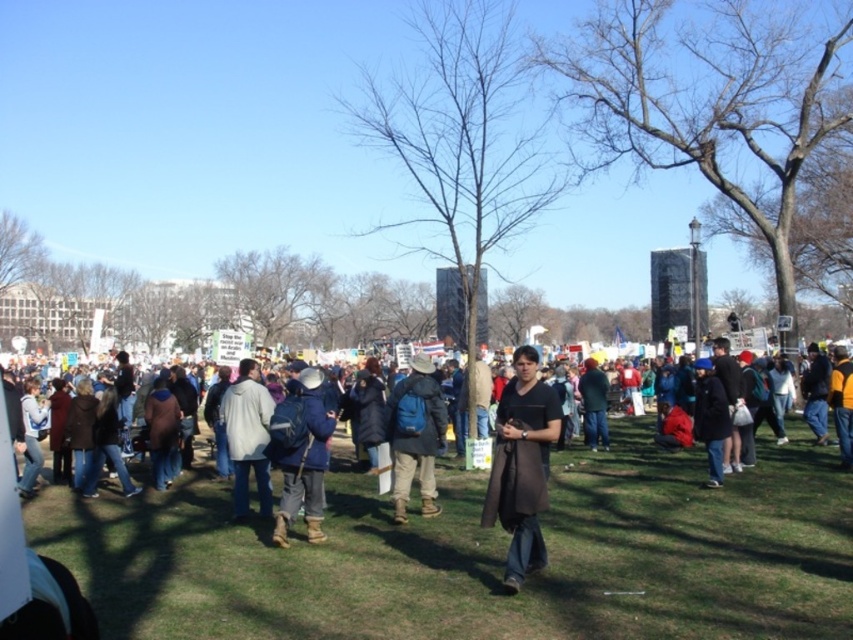
Identify the location of blue fabric jacket at center. (302, 458).

Where is `blue fabric jacket at center`? The image size is (853, 640). blue fabric jacket at center is located at coordinates (302, 458).

Which is more to the right, green grass at center or blue fabric jacket at center?

Positioned to the right is green grass at center.

What do you see at coordinates (480, 556) in the screenshot? Image resolution: width=853 pixels, height=640 pixels. I see `green grass at center` at bounding box center [480, 556].

Does point (810, 454) come closer to viewer compared to point (306, 502)?

No.

I want to click on green grass at center, so tap(480, 556).

Is blue backpack at center to the right of dark blue fabric jacket at center from the viewer's perspective?

No, blue backpack at center is not to the right of dark blue fabric jacket at center.

Between point (397, 464) and point (718, 440), which one is positioned behind?

The point (718, 440) is more distant.

Locate an element on the screen. This screenshot has height=640, width=853. blue backpack at center is located at coordinates (415, 435).